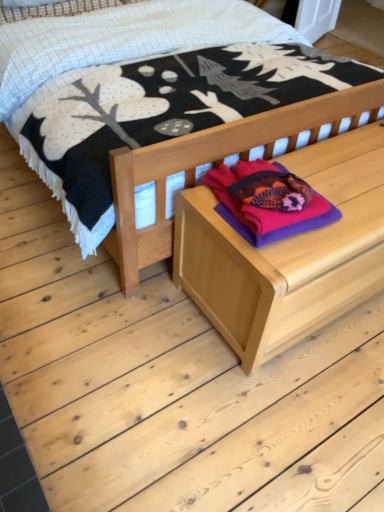
Question: Is purple fleece sweater at center oriented away from natural wood bed at center?

Choices:
 (A) no
 (B) yes

Answer: (B)

Question: Considering the relative sizes of purple fleece sweater at center and natural wood bed at center in the image provided, is purple fleece sweater at center thinner than natural wood bed at center?

Choices:
 (A) yes
 (B) no

Answer: (A)

Question: Is purple fleece sweater at center closer to camera compared to natural wood bed at center?

Choices:
 (A) no
 (B) yes

Answer: (A)

Question: Considering the relative sizes of purple fleece sweater at center and natural wood bed at center in the image provided, is purple fleece sweater at center smaller than natural wood bed at center?

Choices:
 (A) yes
 (B) no

Answer: (A)

Question: Considering the relative sizes of purple fleece sweater at center and natural wood bed at center in the image provided, is purple fleece sweater at center taller than natural wood bed at center?

Choices:
 (A) yes
 (B) no

Answer: (B)

Question: Is natural wood bed at center completely or partially inside purple fleece sweater at center?

Choices:
 (A) no
 (B) yes

Answer: (A)

Question: From the image's perspective, is natural wood bed at center below purple fleece sweater at center?

Choices:
 (A) yes
 (B) no

Answer: (B)

Question: Is the depth of natural wood bed at center less than that of purple fleece sweater at center?

Choices:
 (A) no
 (B) yes

Answer: (B)

Question: Is natural wood bed at center smaller than purple fleece sweater at center?

Choices:
 (A) yes
 (B) no

Answer: (B)

Question: Can you confirm if natural wood bed at center is wider than purple fleece sweater at center?

Choices:
 (A) yes
 (B) no

Answer: (A)

Question: Is natural wood bed at center bigger than purple fleece sweater at center?

Choices:
 (A) no
 (B) yes

Answer: (B)

Question: Could you tell me if natural wood bed at center is turned towards purple fleece sweater at center?

Choices:
 (A) no
 (B) yes

Answer: (B)

Question: Is natural wood bed at center facing away from wooden chest at center?

Choices:
 (A) no
 (B) yes

Answer: (A)